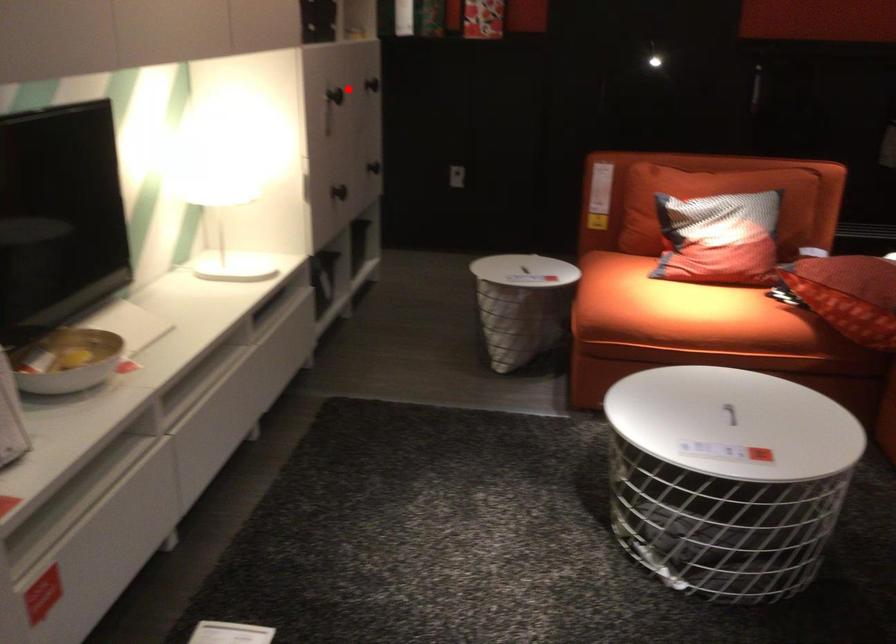
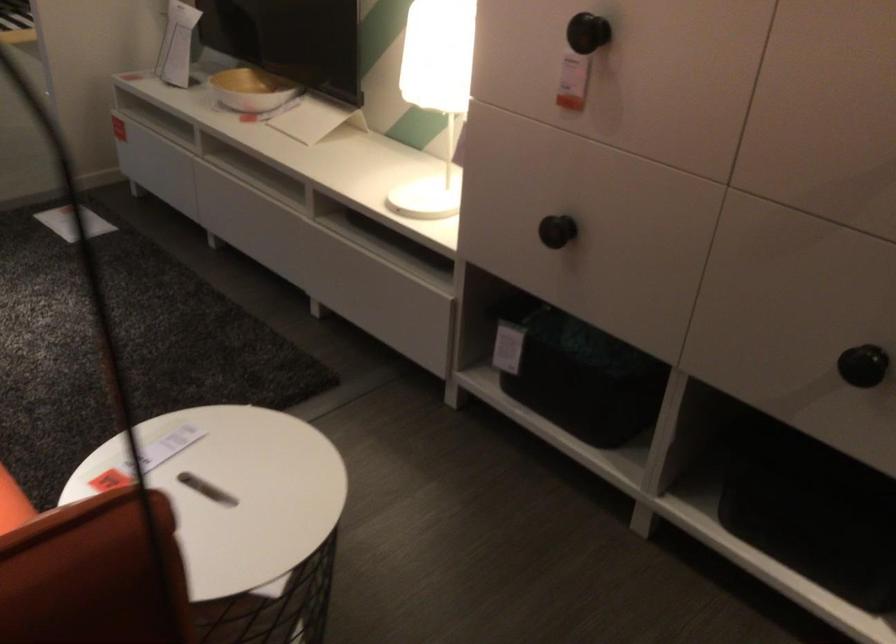
Question: I am providing you with two images of the same scene from different viewpoints. Image1 has a red point marked. In image2, the corresponding 3D location appears at what relative position? Reply with the corresponding letter.

Choices:
 (A) Closer
 (B) Farther

Answer: (A)